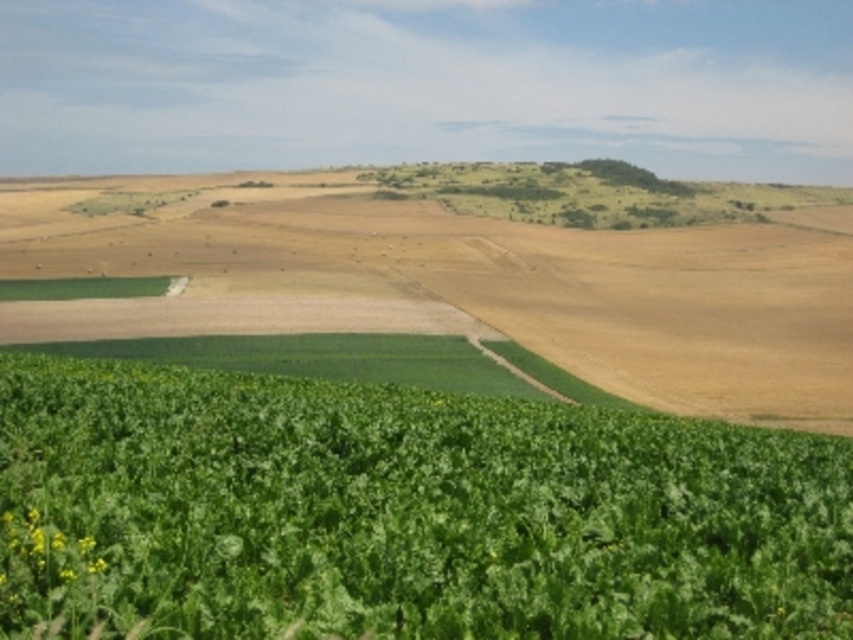
Question: Is green leafy plant at lower left below green leafy field at lower center?

Choices:
 (A) no
 (B) yes

Answer: (B)

Question: Which object is closer to the camera taking this photo?

Choices:
 (A) green leafy plant at lower left
 (B) green leafy field at lower center

Answer: (A)

Question: Which point is farther to the camera?

Choices:
 (A) (242, 296)
 (B) (502, 634)

Answer: (A)

Question: Can you confirm if green leafy plant at lower left is wider than green leafy field at lower center?

Choices:
 (A) yes
 (B) no

Answer: (B)

Question: Is green leafy plant at lower left positioned at the back of green leafy field at lower center?

Choices:
 (A) yes
 (B) no

Answer: (B)